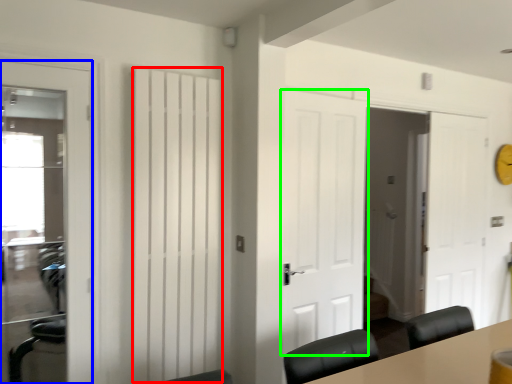
Question: Which object is the farthest from curtain (highlighted by a red box)? Choose among these: door (highlighted by a blue box) or door (highlighted by a green box).

Choices:
 (A) door
 (B) door

Answer: (B)